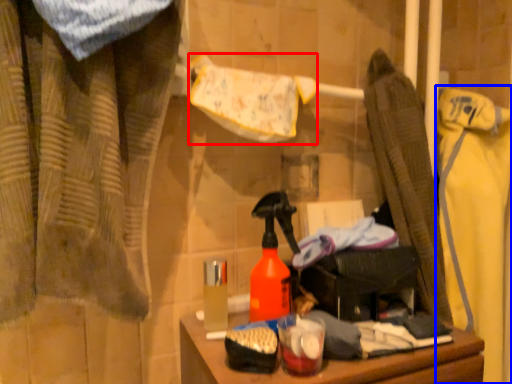
Question: Which object appears closest to the camera in this image, bath towel (highlighted by a red box) or clothing (highlighted by a blue box)?

Choices:
 (A) bath towel
 (B) clothing

Answer: (A)